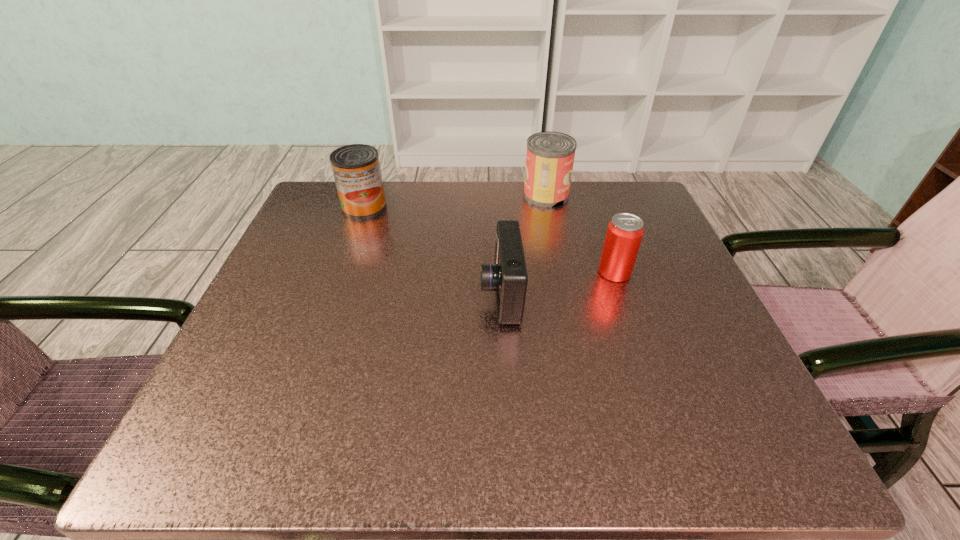
Locate an element on the screen. This screenshot has height=540, width=960. free space between the third object from left to right and the leftmost object is located at coordinates (455, 201).

The width and height of the screenshot is (960, 540). Find the location of `vacant point located between the nearest can and the second object from left to right`. vacant point located between the nearest can and the second object from left to right is located at coordinates (558, 283).

Where is `free space between the second object from left to right and the leftmost can`? The width and height of the screenshot is (960, 540). free space between the second object from left to right and the leftmost can is located at coordinates (433, 251).

Where is `vacant space that is in between the second object from left to right and the second can from left to right`? This screenshot has width=960, height=540. vacant space that is in between the second object from left to right and the second can from left to right is located at coordinates (523, 245).

Find the location of a particular element. This screenshot has height=540, width=960. free spot between the rightmost can and the leftmost can is located at coordinates (490, 240).

The width and height of the screenshot is (960, 540). Find the location of `vacant region between the second object from left to right and the nearest can`. vacant region between the second object from left to right and the nearest can is located at coordinates (558, 283).

You are a GUI agent. You are given a task and a screenshot of the screen. Output one action in this format:
    pyautogui.click(x=<x>, y=<y>)
    Task: Click on the vacant space that is in between the camera and the second can from right to left
    The width and height of the screenshot is (960, 540).
    Given the screenshot: What is the action you would take?
    pyautogui.click(x=523, y=245)

Find the location of `vacant point located between the third object from right to left and the third object from left to right`. vacant point located between the third object from right to left and the third object from left to right is located at coordinates (523, 245).

Where is `free space that is in between the third object from right to left and the third object from left to right`? This screenshot has width=960, height=540. free space that is in between the third object from right to left and the third object from left to right is located at coordinates (523, 245).

Locate an element on the screen. The width and height of the screenshot is (960, 540). free spot between the second object from right to left and the rightmost can is located at coordinates tap(580, 234).